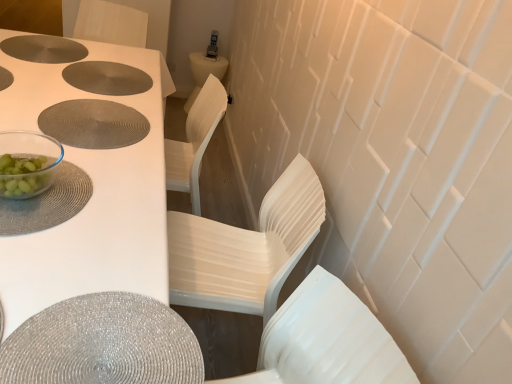
Question: From a real-world perspective, is shiny silver placemat at lower left physically located above or below matte gray placemat at upper left, which is counted as the second hole, starting from the top?

Choices:
 (A) above
 (B) below

Answer: (B)

Question: From the image's perspective, is shiny silver placemat at lower left positioned above or below matte gray placemat at upper left, the second hole positioned from the bottom?

Choices:
 (A) above
 (B) below

Answer: (B)

Question: Which of these objects is positioned farthest from the white glossy table at upper left?

Choices:
 (A) green glass bowl at upper left
 (B) matte gray placemat at upper left, placed as the 3th hole when sorted from bottom to top
 (C) matte gray placemat at upper left, the second hole positioned from the bottom
 (D) matte silver placemat at center, the third hole positioned from the top
 (E) shiny silver placemat at lower left

Answer: (B)

Question: Which object is the farthest from the matte silver placemat at center, the third hole positioned from the top?

Choices:
 (A) green glass bowl at upper left
 (B) matte gray placemat at upper left, the second hole positioned from the bottom
 (C) matte gray placemat at upper left, the 1th hole in the top-to-bottom sequence
 (D) white plastic chair at center, the first chair positioned from the back
 (E) shiny silver placemat at lower left

Answer: (E)